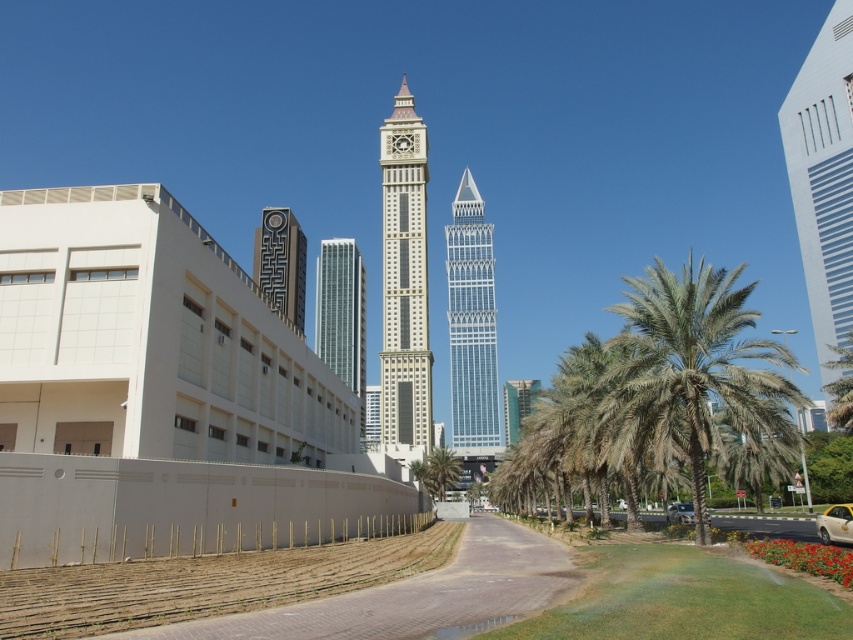
Is silver glass skyscraper at center positioned behind black textured clock tower at center?

No, silver glass skyscraper at center is closer to the viewer.

Can you confirm if silver glass skyscraper at center is bigger than black textured clock tower at center?

Indeed, silver glass skyscraper at center has a larger size compared to black textured clock tower at center.

Is point (345, 353) positioned in front of point (285, 276)?

No, it is behind (285, 276).

This screenshot has width=853, height=640. Find the location of `silver glass skyscraper at center`. silver glass skyscraper at center is located at coordinates (341, 314).

Does green leafy palm tree at right have a greater height compared to black textured clock tower at center?

Yes, green leafy palm tree at right is taller than black textured clock tower at center.

Is green leafy palm tree at right further to the viewer compared to black textured clock tower at center?

That is False.

I want to click on green leafy palm tree at right, so (689, 372).

In order to click on green leafy palm tree at right in this screenshot , I will do `click(689, 372)`.

Does green leafy palm tree at right have a smaller size compared to green glass building at center?

Incorrect, green leafy palm tree at right is not smaller in size than green glass building at center.

Is green leafy palm tree at right closer to the viewer compared to green glass building at center?

Yes.

Identify the location of green leafy palm tree at right. (689, 372).